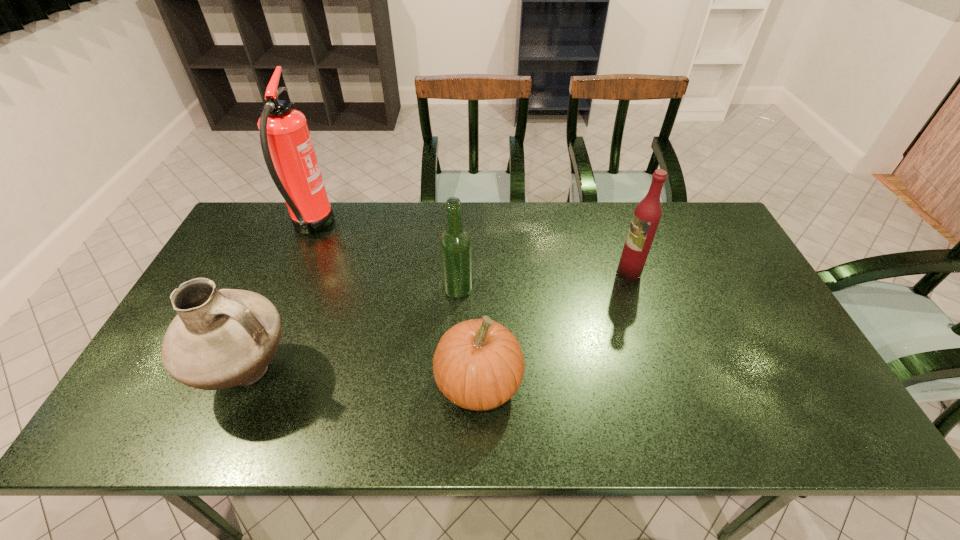
Where is `free space that is in between the right liquor and the pumpkin`? free space that is in between the right liquor and the pumpkin is located at coordinates (554, 328).

Identify which object is the fourth nearest to the pitcher. Please provide its 2D coordinates. Your answer should be formatted as a tuple, i.e. [(x, y)], where the tuple contains the x and y coordinates of a point satisfying the conditions above.

[(646, 217)]

Point out which object is positioned as the third nearest to the tallest object. Please provide its 2D coordinates. Your answer should be formatted as a tuple, i.e. [(x, y)], where the tuple contains the x and y coordinates of a point satisfying the conditions above.

[(478, 364)]

The image size is (960, 540). What are the coordinates of `vacant region that satisfies the following two spatial constraints: 1. at the nozzle of the fire extinguisher; 2. on the left side of the left liquor` in the screenshot? It's located at (284, 289).

The width and height of the screenshot is (960, 540). I want to click on free region that satisfies the following two spatial constraints: 1. on the front side of the left liquor; 2. on the handle side of the pitcher, so click(x=453, y=375).

Identify the location of free space that satisfies the following two spatial constraints: 1. on the label of the right liquor; 2. on the front side of the left liquor. (635, 289).